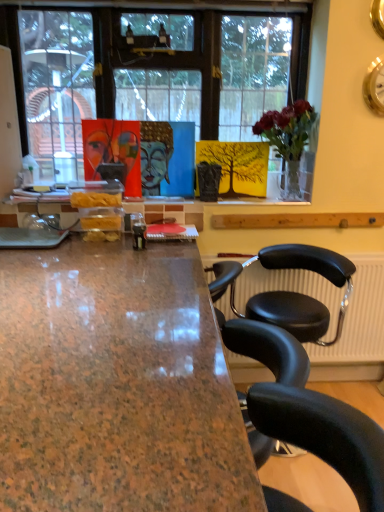
Question: From the image's perspective, is brown polished granite desk at center located above or below blue glossy buddha head at center?

Choices:
 (A) above
 (B) below

Answer: (B)

Question: From their relative heights in the image, would you say brown polished granite desk at center is taller or shorter than blue glossy buddha head at center?

Choices:
 (A) short
 (B) tall

Answer: (B)

Question: Based on their relative distances, which object is nearer to the matte acrylic painting of a human face at upper center?

Choices:
 (A) blue glossy buddha head at center
 (B) brown polished granite desk at center
 (C) black leather chair at right

Answer: (A)

Question: Which object is the closest to the matte acrylic painting of a human face at upper center?

Choices:
 (A) brown polished granite desk at center
 (B) blue glossy buddha head at center
 (C) black leather chair at right

Answer: (B)